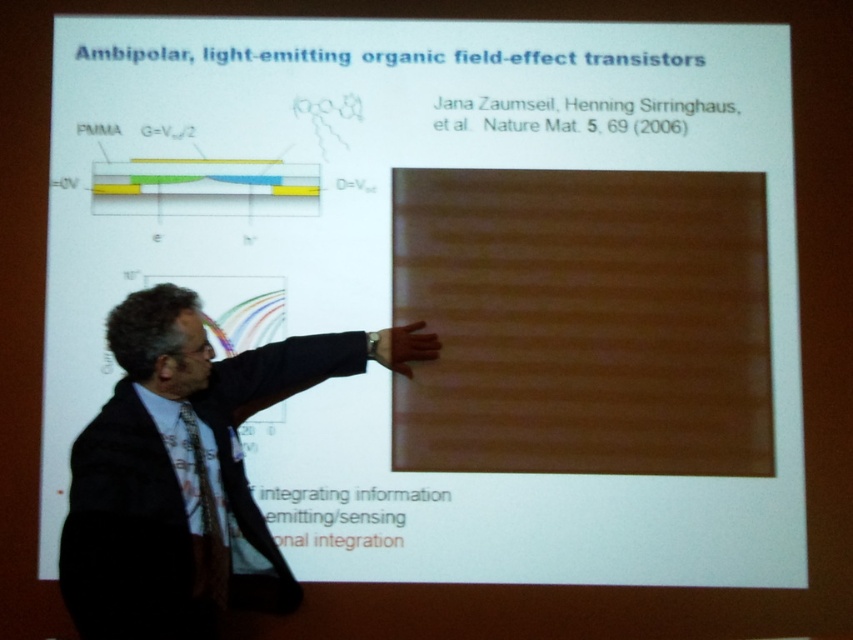
Question: Does dark suit at center lie behind black textured tie at center?

Choices:
 (A) no
 (B) yes

Answer: (A)

Question: Is dark suit at center thinner than black textured tie at center?

Choices:
 (A) no
 (B) yes

Answer: (A)

Question: Which object appears closest to the camera in this image?

Choices:
 (A) black textured tie at center
 (B) dark suit at center

Answer: (B)

Question: Which of the following is the closest to the observer?

Choices:
 (A) black textured tie at center
 (B) dark suit at center

Answer: (B)

Question: Is dark suit at center positioned at the back of black textured tie at center?

Choices:
 (A) yes
 (B) no

Answer: (B)